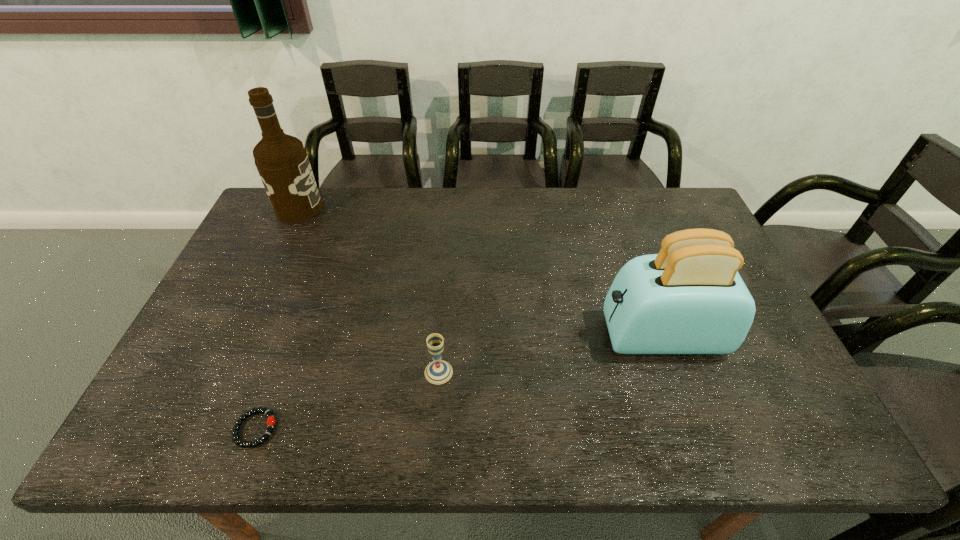
In the image, there is a desktop. In order to click on vacant space at the near edge in this screenshot , I will do `click(545, 439)`.

Find the location of `free space at the left edge of the desktop`. free space at the left edge of the desktop is located at coordinates tap(228, 364).

I want to click on free space at the right edge, so click(761, 404).

This screenshot has height=540, width=960. I want to click on vacant space at the far right corner, so click(663, 230).

This screenshot has height=540, width=960. Find the location of `free point between the alcohol and the toaster`. free point between the alcohol and the toaster is located at coordinates coord(480,272).

Find the location of a particular element. Image resolution: width=960 pixels, height=540 pixels. vacant point located between the toaster and the leftmost object is located at coordinates (480, 272).

You are a GUI agent. You are given a task and a screenshot of the screen. Output one action in this format:
    pyautogui.click(x=<x>, y=<y>)
    Task: Click on the blank region between the bracelet and the alcohol
    The image size is (960, 540).
    Given the screenshot: What is the action you would take?
    pyautogui.click(x=277, y=319)

At what (x,y) coordinates should I click in order to perform the action: click on free space between the third tallest object and the tallest object. Please return your answer as a coordinate pair (x, y). This screenshot has width=960, height=540. Looking at the image, I should click on (369, 291).

You are a GUI agent. You are given a task and a screenshot of the screen. Output one action in this format:
    pyautogui.click(x=<x>, y=<y>)
    Task: Click on the unoccupied area between the leftmost object and the rightmost object
    The height and width of the screenshot is (540, 960).
    Given the screenshot: What is the action you would take?
    pyautogui.click(x=480, y=272)

Locate an element on the screen. free spot between the rightmost object and the third object from left to right is located at coordinates (550, 354).